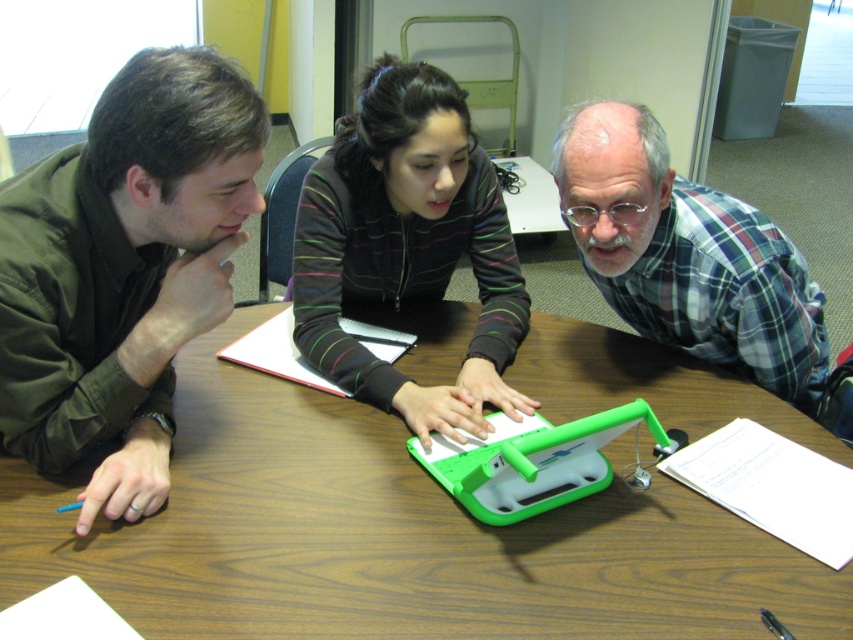
Does wooden table at center have a larger size compared to matte green shirt at left?

Yes.

Can you confirm if wooden table at center is thinner than matte green shirt at left?

In fact, wooden table at center might be wider than matte green shirt at left.

Describe the element at coordinates (392, 536) in the screenshot. The height and width of the screenshot is (640, 853). I see `wooden table at center` at that location.

Locate an element on the screen. Image resolution: width=853 pixels, height=640 pixels. wooden table at center is located at coordinates (392, 536).

Who is lower down, wooden table at center or striped fleece jacket at center?

wooden table at center

Which is in front, point (631, 445) or point (421, 156)?

Point (631, 445) is more forward.

Which is behind, point (282, 568) or point (498, 387)?

The point (498, 387) is behind.

I want to click on wooden table at center, so click(x=392, y=536).

Which of these two, matte green shirt at left or striped fleece jacket at center, stands shorter?

matte green shirt at left is shorter.

Can you confirm if matte green shirt at left is taller than striped fleece jacket at center?

In fact, matte green shirt at left may be shorter than striped fleece jacket at center.

Who is more forward, (161, 54) or (494, 192)?

Point (161, 54) is more forward.

The image size is (853, 640). Find the location of `matte green shirt at left`. matte green shirt at left is located at coordinates (123, 269).